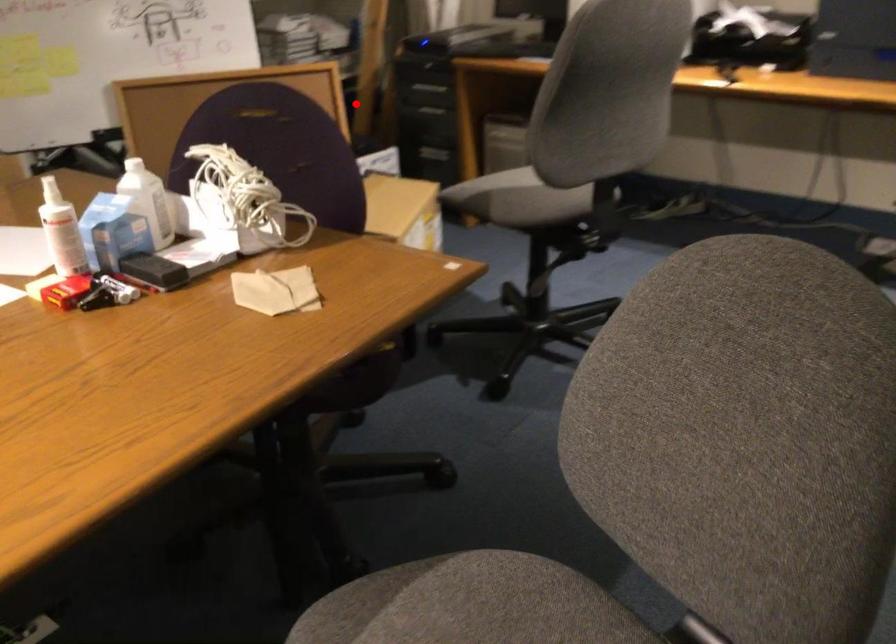
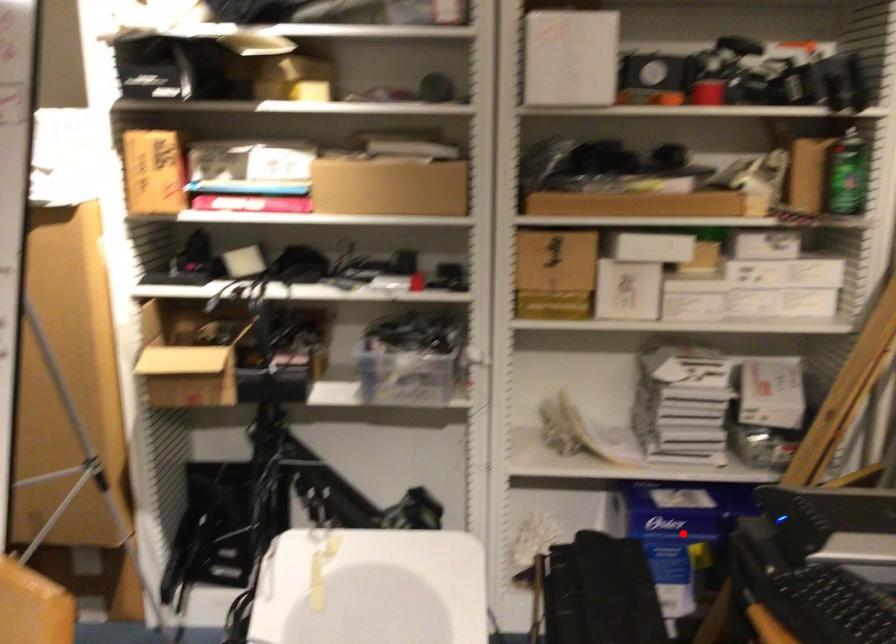
I am providing you with two images of the same scene from different viewpoints. A red point is marked on the first image and another point is marked on the second image. Are the points marked in image1 and image2 representing the same 3D position?

Yes